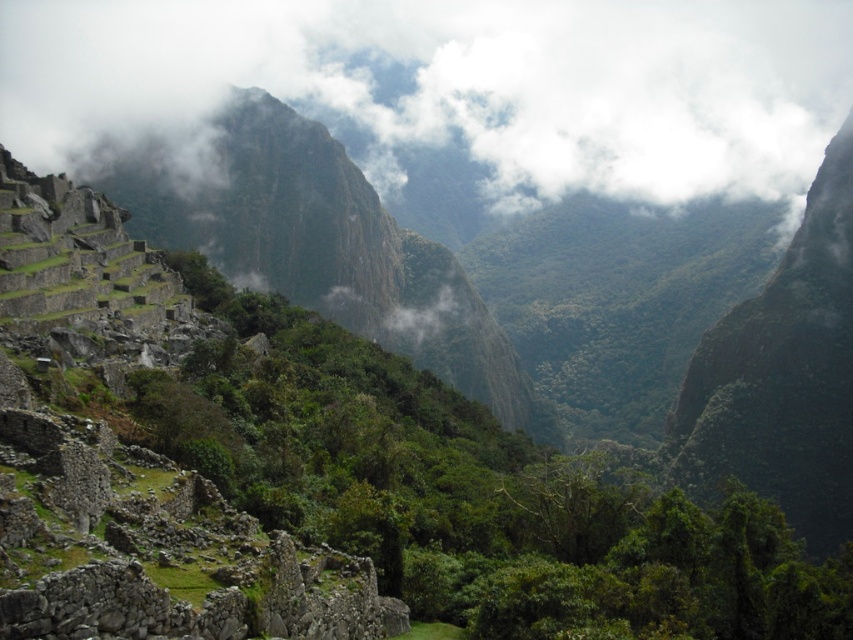
You are a photographer at Machu Picchu and want to capture the white fluffy cloud at upper center and the green leafy vegetation at center in your shot. Which object appears taller in the frame?

The white fluffy cloud at upper center appears taller than the green leafy vegetation at center in the frame.

You are a tourist at Machu Picchu and want to take a photo that includes both the white fluffy cloud at upper center and the green leafy vegetation at center. Based on their positions, which object should you point your camera towards first to ensure both are in the frame?

You should point your camera towards the white fluffy cloud at upper center first because it is above the green leafy vegetation at center, so adjusting the angle to include both would require framing from the top downward.